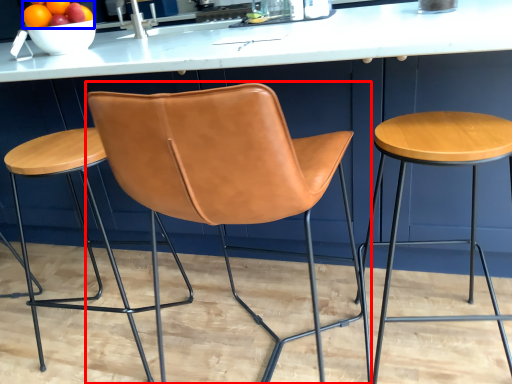
Question: Which object appears closest to the camera in this image, chair (highlighted by a red box) or fruit (highlighted by a blue box)?

Choices:
 (A) chair
 (B) fruit

Answer: (A)